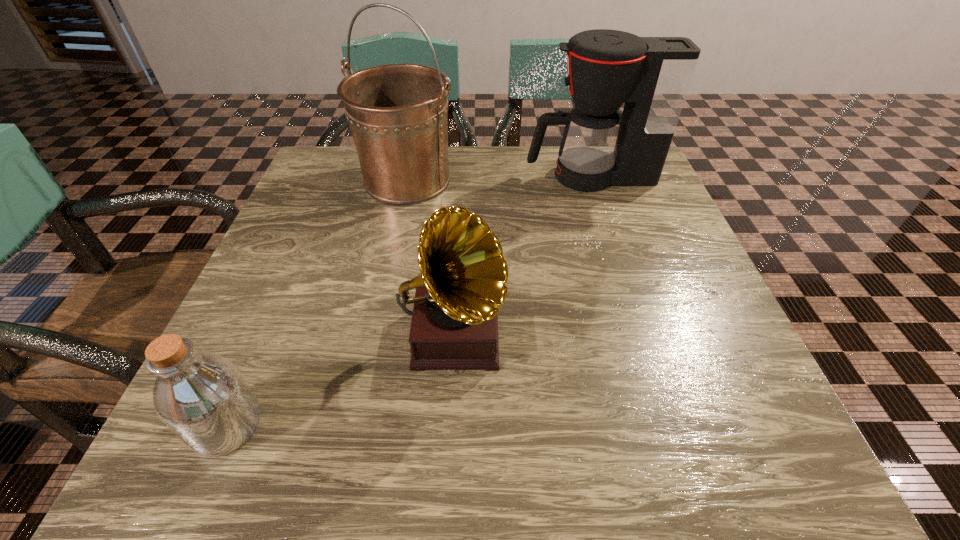
You are a GUI agent. You are given a task and a screenshot of the screen. Output one action in this format:
    pyautogui.click(x=<x>, y=<y>)
    Task: Click on the object present at the far right corner
    The height and width of the screenshot is (540, 960).
    Given the screenshot: What is the action you would take?
    pyautogui.click(x=652, y=75)

What are the coordinates of `vacant space at the far edge` in the screenshot? It's located at (557, 196).

Where is `vacant space at the near edge of the desktop`? vacant space at the near edge of the desktop is located at coordinates (501, 454).

In the image, there is a desktop. Where is `vacant area at the left edge`? The image size is (960, 540). vacant area at the left edge is located at coordinates (303, 231).

The image size is (960, 540). In the image, there is a desktop. What are the coordinates of `vacant space at the right edge` in the screenshot? It's located at (698, 353).

This screenshot has height=540, width=960. In order to click on free location at the far left corner in this screenshot , I will do `click(315, 173)`.

At what (x,y) coordinates should I click in order to perform the action: click on vacant space at the far right corner of the desktop. Please return your answer as a coordinate pair (x, y). The height and width of the screenshot is (540, 960). Looking at the image, I should click on (621, 199).

Where is `vacant space at the near right corner of the desktop`? vacant space at the near right corner of the desktop is located at coordinates (785, 470).

The height and width of the screenshot is (540, 960). Identify the location of vacant space in between the third tallest object and the coffee maker. (522, 255).

In order to click on vacant area between the coffee maker and the tallest object in this screenshot , I will do `click(499, 178)`.